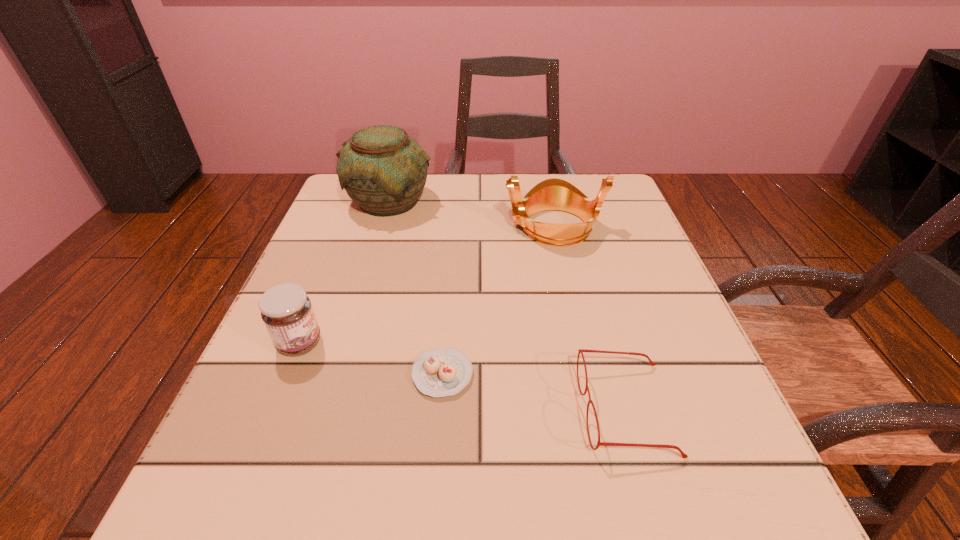
Locate an element on the screen. Image resolution: width=960 pixels, height=540 pixels. tiara that is at the right edge is located at coordinates (552, 194).

Where is `spectacles that is at the right edge`? spectacles that is at the right edge is located at coordinates pyautogui.click(x=581, y=351).

I want to click on object at the far left corner, so click(383, 170).

Locate an element on the screen. The width and height of the screenshot is (960, 540). object that is positioned at the far right corner is located at coordinates point(552,194).

Where is `object that is at the near right corner`? The height and width of the screenshot is (540, 960). object that is at the near right corner is located at coordinates (581, 351).

In the image, there is a desktop. Where is `vacant area at the far edge`? vacant area at the far edge is located at coordinates (492, 197).

Identify the location of vacant region at the left edge. (315, 232).

Locate an element on the screen. free space at the right edge of the desktop is located at coordinates (643, 283).

At what (x,y) coordinates should I click in order to perform the action: click on vacant space at the near left corner of the desktop. Please return your answer as a coordinate pair (x, y). This screenshot has height=540, width=960. Looking at the image, I should click on (243, 528).

In order to click on vacant area at the far right corner in this screenshot , I will do `click(631, 204)`.